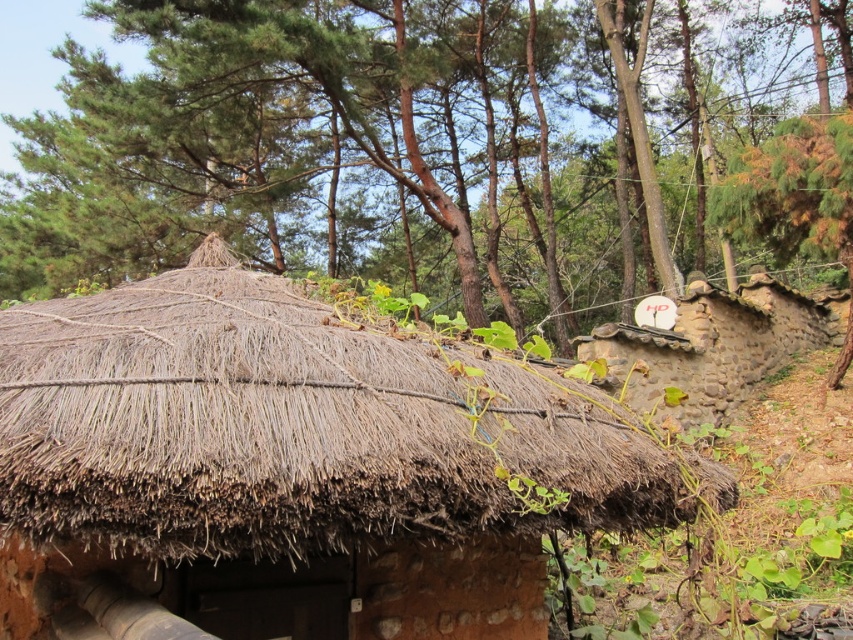
Does brown thatch roof at upper center appear over brown stone hut at upper right?

Correct, brown thatch roof at upper center is located above brown stone hut at upper right.

This screenshot has height=640, width=853. What do you see at coordinates (437, 148) in the screenshot? I see `brown thatch roof at upper center` at bounding box center [437, 148].

Which is behind, point (814, 20) or point (750, 280)?

The point (814, 20) is more distant.

Find the location of a particular element. brown thatch roof at upper center is located at coordinates (437, 148).

Does brown thatch roof at upper center have a greater height compared to brown thatch roof at center?

Yes.

Does point (419, 35) come in front of point (280, 541)?

No, (419, 35) is further to viewer.

In order to click on brown thatch roof at upper center in this screenshot , I will do click(x=437, y=148).

Between brown thatch roof at center and brown stone hut at upper right, which one has less height?

With less height is brown stone hut at upper right.

Which is in front, point (379, 440) or point (704, 369)?

Point (379, 440) is in front.

Find the location of a particular element. brown thatch roof at center is located at coordinates (294, 428).